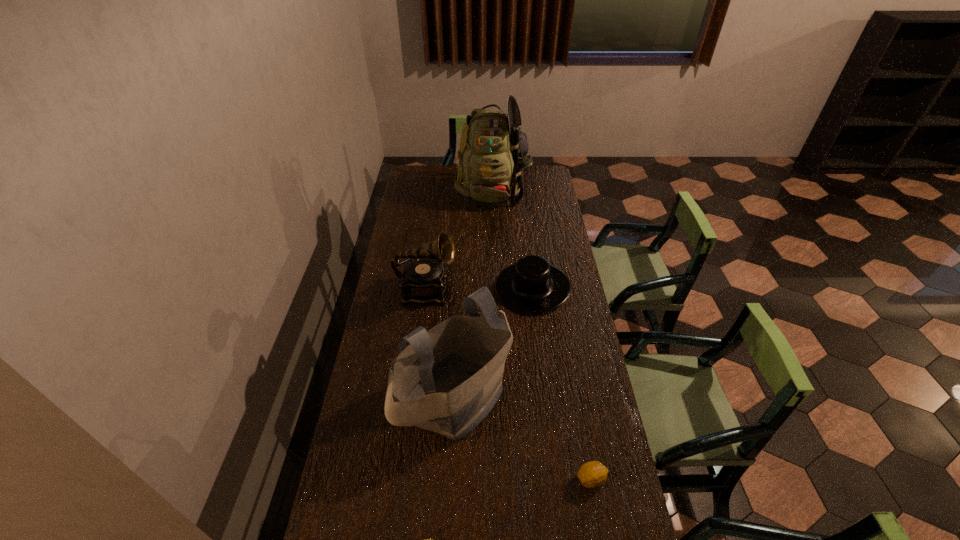
Locate an element on the screen. The image size is (960, 540). the farthest object is located at coordinates (493, 151).

Identify the location of the tallest object. pyautogui.click(x=493, y=151).

The height and width of the screenshot is (540, 960). I want to click on the fifth shortest object, so click(x=449, y=378).

Where is `shopping bag`? The width and height of the screenshot is (960, 540). shopping bag is located at coordinates (449, 378).

Identify the location of phonograph record. (424, 279).

Image resolution: width=960 pixels, height=540 pixels. Identify the location of the third shortest object. (532, 285).

Image resolution: width=960 pixels, height=540 pixels. Identify the location of the second nearest object. (592, 474).

Where is `free space located 0.390m on the front-facing side of the tallest object`? The image size is (960, 540). free space located 0.390m on the front-facing side of the tallest object is located at coordinates (495, 263).

Where is `vacant space located on the left of the third nearest object`? The height and width of the screenshot is (540, 960). vacant space located on the left of the third nearest object is located at coordinates (369, 397).

I want to click on free space located 0.060m on the horn of the phonograph record, so click(x=472, y=291).